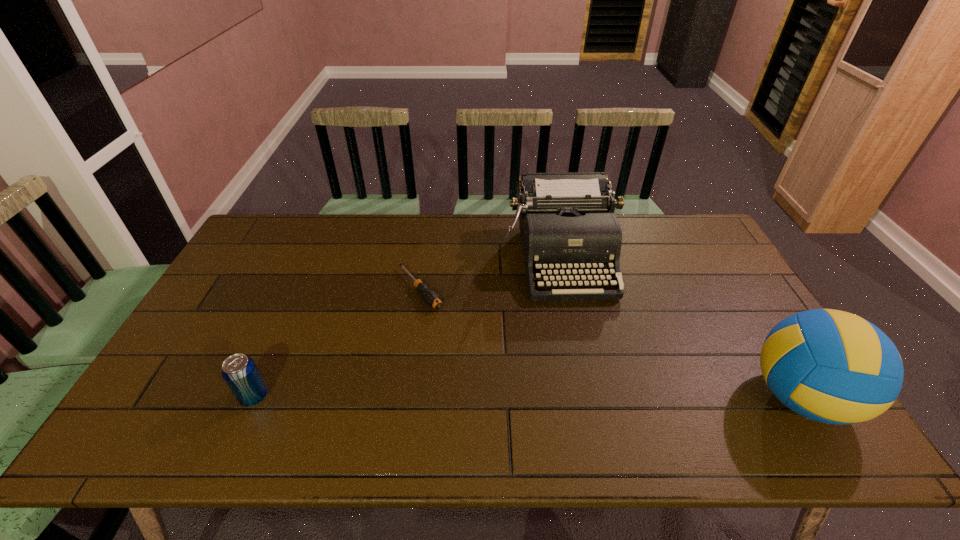
Locate an element on the screen. vacant space that satisfies the following two spatial constraints: 1. on the back side of the beer can; 2. on the right side of the shortest object is located at coordinates (301, 289).